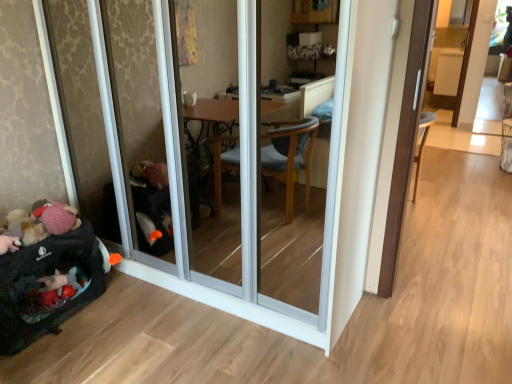
Question: Is dark gray fabric baby carriage at lower left positioned behind transparent glass screen door at left?

Choices:
 (A) no
 (B) yes

Answer: (B)

Question: Considering the relative sizes of dark gray fabric baby carriage at lower left and transparent glass screen door at left in the image provided, is dark gray fabric baby carriage at lower left wider than transparent glass screen door at left?

Choices:
 (A) no
 (B) yes

Answer: (A)

Question: Does dark gray fabric baby carriage at lower left have a smaller size compared to transparent glass screen door at left?

Choices:
 (A) no
 (B) yes

Answer: (B)

Question: From a real-world perspective, is dark gray fabric baby carriage at lower left below transparent glass screen door at left?

Choices:
 (A) no
 (B) yes

Answer: (B)

Question: Considering the relative positions of dark gray fabric baby carriage at lower left and transparent glass screen door at left in the image provided, is dark gray fabric baby carriage at lower left to the right of transparent glass screen door at left from the viewer's perspective?

Choices:
 (A) yes
 (B) no

Answer: (B)

Question: Is transparent glass screen door at left located within dark gray fabric baby carriage at lower left?

Choices:
 (A) no
 (B) yes

Answer: (A)

Question: From the image's perspective, is transparent glass screen door at left located above dark gray fabric baby carriage at lower left?

Choices:
 (A) yes
 (B) no

Answer: (A)

Question: Is transparent glass screen door at left oriented away from dark gray fabric baby carriage at lower left?

Choices:
 (A) yes
 (B) no

Answer: (B)

Question: Is transparent glass screen door at left aimed at dark gray fabric baby carriage at lower left?

Choices:
 (A) no
 (B) yes

Answer: (B)

Question: Considering the relative positions of transparent glass screen door at left and dark gray fabric baby carriage at lower left in the image provided, is transparent glass screen door at left behind dark gray fabric baby carriage at lower left?

Choices:
 (A) no
 (B) yes

Answer: (A)

Question: Is transparent glass screen door at left closer to camera compared to dark gray fabric baby carriage at lower left?

Choices:
 (A) yes
 (B) no

Answer: (A)

Question: Could dark gray fabric baby carriage at lower left be considered to be inside transparent glass screen door at left?

Choices:
 (A) yes
 (B) no

Answer: (B)

Question: Is dark gray fabric baby carriage at lower left in front of or behind transparent glass screen door at left in the image?

Choices:
 (A) behind
 (B) front

Answer: (A)